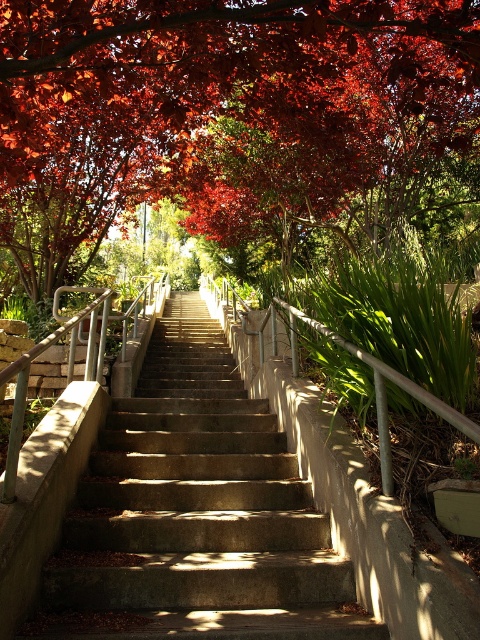
Does shiny red leaves at upper center appear under concrete stairs at center?

Incorrect, shiny red leaves at upper center is not positioned below concrete stairs at center.

Does shiny red leaves at upper center appear over concrete stairs at center?

Correct, shiny red leaves at upper center is located above concrete stairs at center.

Does point (326, 124) come closer to viewer compared to point (151, 476)?

No, it is behind (151, 476).

The width and height of the screenshot is (480, 640). In order to click on shiny red leaves at upper center in this screenshot , I will do `click(211, 106)`.